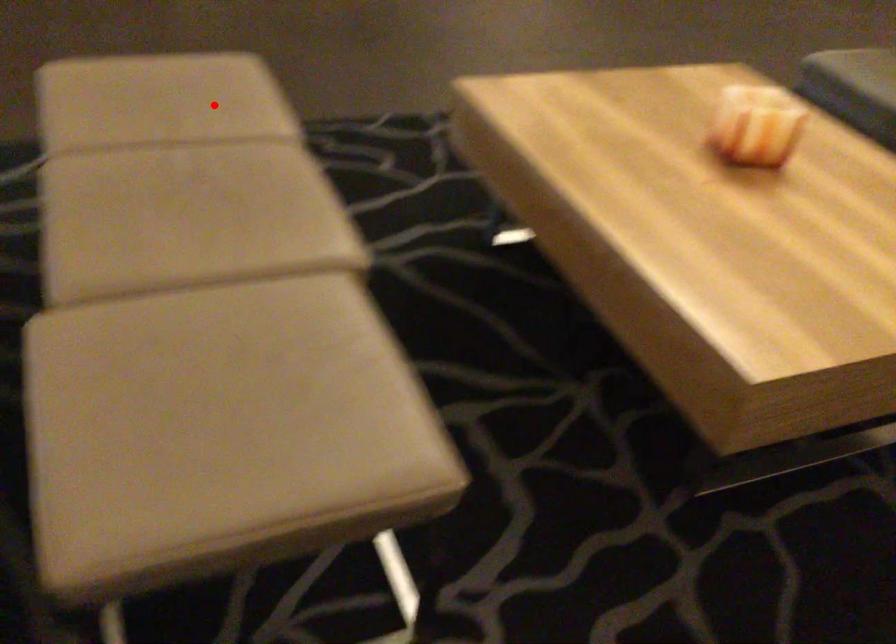
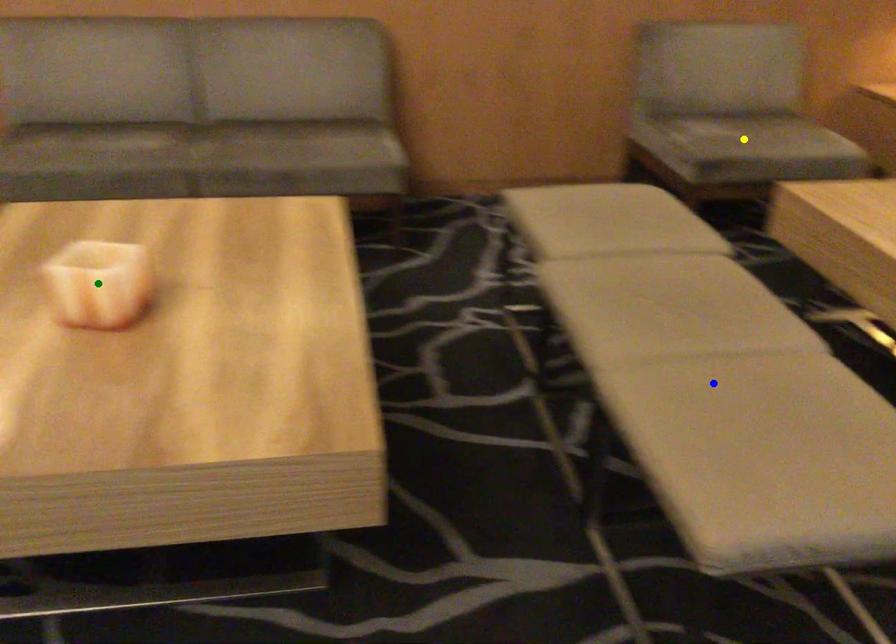
Question: I am providing you with two images of the same scene from different viewpoints. A red point is marked on the first image. You are given multiple points on the second image. Which point in image 2 is actually the same real-world point as the red point in image 1?

Choices:
 (A) yellow point
 (B) blue point
 (C) green point

Answer: (B)